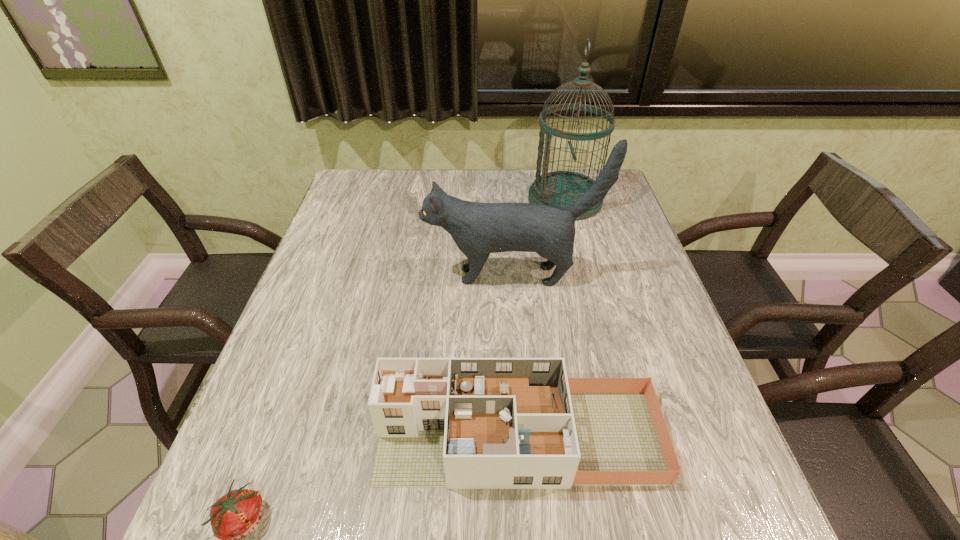
At what (x,y) coordinates should I click in order to perform the action: click on the tallest object. Please return your answer as a coordinate pair (x, y). Looking at the image, I should click on (562, 188).

Where is `birdcage`? The image size is (960, 540). birdcage is located at coordinates tap(562, 188).

Identify the location of the third nearest object. (478, 229).

Locate an element on the screen. The width and height of the screenshot is (960, 540). cat is located at coordinates (478, 229).

I want to click on the third farthest object, so click(459, 423).

Locate an element on the screen. The width and height of the screenshot is (960, 540). dollhouse is located at coordinates (459, 423).

At what (x,y) coordinates should I click in order to perform the action: click on free space located 0.130m on the front-facing side of the tallest object. Please return your answer as a coordinate pair (x, y). Looking at the image, I should click on pos(488,200).

Locate an element on the screen. Image resolution: width=960 pixels, height=540 pixels. vacant point located on the front-facing side of the tallest object is located at coordinates (449, 200).

Find the location of a particular element. Image resolution: width=960 pixels, height=540 pixels. free location located 0.180m on the front-facing side of the tallest object is located at coordinates (471, 200).

Where is `vacant space located 0.290m at the face of the cat`? Image resolution: width=960 pixels, height=540 pixels. vacant space located 0.290m at the face of the cat is located at coordinates (313, 275).